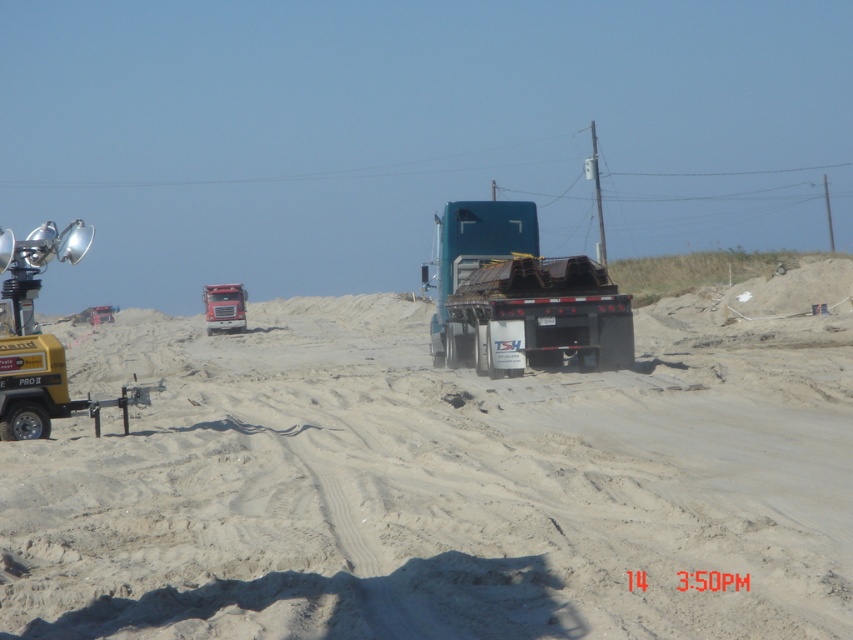
You are a construction worker standing on the sandy dirt field at center. You need to lift a heavy object onto the teal matte trailer truck at center. Can you directly place the object onto the truck bed without any assistance?

The sandy dirt field at center is shorter than the teal matte trailer truck at center, so you cannot directly place the object onto the truck bed without assistance such as a ramp or lift.

You are a worker on the construction site. You see the yellow metallic light at left and the matte red truck at center. Which object is positioned higher in the image?

The yellow metallic light at left is located above the matte red truck at center, so it is positioned higher in the image.